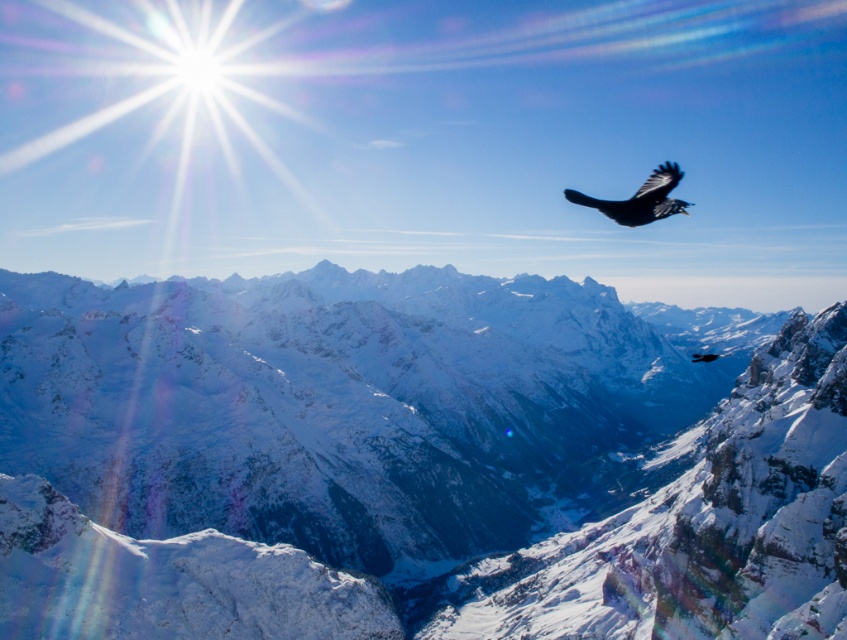
Question: Among these objects, which one is farthest from the camera?

Choices:
 (A) snowy granite mountain range at center
 (B) shiny black bird at upper right

Answer: (A)

Question: Which object appears closest to the camera in this image?

Choices:
 (A) shiny black bird at upper right
 (B) snowy granite mountain range at center

Answer: (A)

Question: Can you confirm if snowy granite mountain range at center is thinner than shiny black bird at upper right?

Choices:
 (A) no
 (B) yes

Answer: (A)

Question: Is snowy granite mountain range at center above shiny black bird at upper right?

Choices:
 (A) yes
 (B) no

Answer: (B)

Question: Does snowy granite mountain range at center have a greater width compared to shiny black bird at upper right?

Choices:
 (A) yes
 (B) no

Answer: (A)